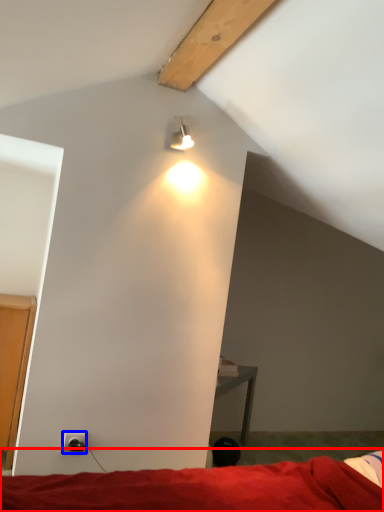
Question: Among these objects, which one is nearest to the camera, bed (highlighted by a red box) or power outlet (highlighted by a blue box)?

Choices:
 (A) bed
 (B) power outlet

Answer: (A)